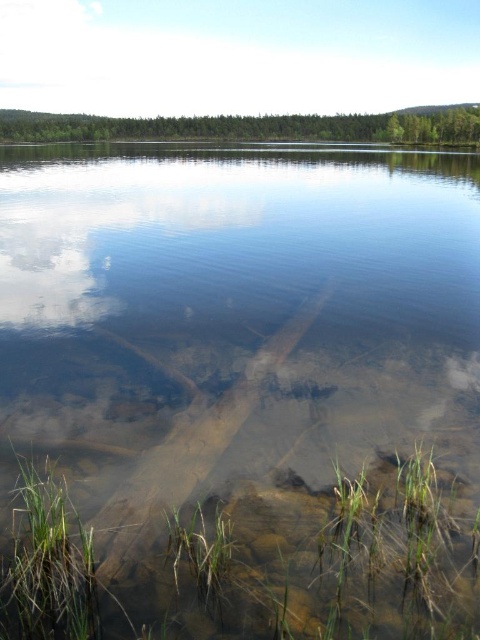
Question: Can you confirm if green grassy at lower left is smaller than white fluffy cloud at upper center?

Choices:
 (A) yes
 (B) no

Answer: (A)

Question: Which point is farther to the camera?

Choices:
 (A) (113, 106)
 (B) (294, 588)

Answer: (A)

Question: Which of the following is the farthest from the observer?

Choices:
 (A) (98, 592)
 (B) (90, 19)

Answer: (B)

Question: Considering the relative positions of green grassy at lower left and white fluffy cloud at upper center in the image provided, where is green grassy at lower left located with respect to white fluffy cloud at upper center?

Choices:
 (A) below
 (B) above

Answer: (A)

Question: Among these objects, which one is nearest to the camera?

Choices:
 (A) green grassy at lower left
 (B) white fluffy cloud at upper center

Answer: (A)

Question: Can you confirm if green grassy at lower left is smaller than white fluffy cloud at upper center?

Choices:
 (A) no
 (B) yes

Answer: (B)